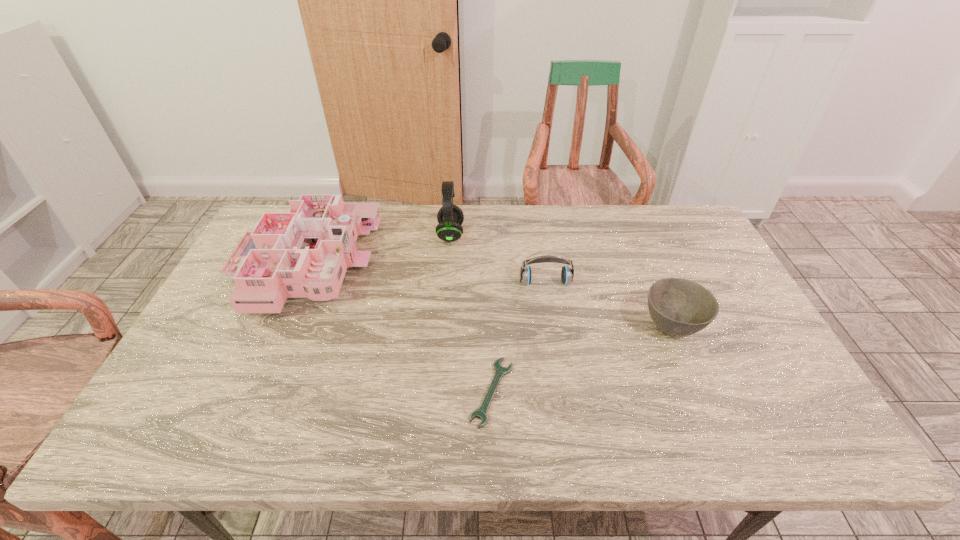
The image size is (960, 540). Find the location of `vacant space at the near edge of the desktop`. vacant space at the near edge of the desktop is located at coordinates (684, 423).

The height and width of the screenshot is (540, 960). In the image, there is a desktop. What are the coordinates of `free space at the left edge` in the screenshot? It's located at (217, 333).

In the image, there is a desktop. Where is `vacant space at the right edge`? The image size is (960, 540). vacant space at the right edge is located at coordinates [745, 321].

Find the location of a particular element. Image resolution: width=960 pixels, height=540 pixels. free space at the far right corner of the desktop is located at coordinates (674, 229).

Find the location of a particular element. The image size is (960, 540). free space between the leftmost object and the left headset is located at coordinates pos(377,249).

At what (x,y) coordinates should I click in order to perform the action: click on empty space between the dollhouse and the right headset. Please return your answer as a coordinate pair (x, y). Image resolution: width=960 pixels, height=540 pixels. Looking at the image, I should click on (425, 273).

I want to click on free spot between the taller headset and the second object from right to left, so click(498, 259).

You are a GUI agent. You are given a task and a screenshot of the screen. Output one action in this format:
    pyautogui.click(x=<x>, y=<y>)
    Task: Click on the empty space that is in between the fourth object from right to left and the right headset
    
    Given the screenshot: What is the action you would take?
    pyautogui.click(x=498, y=259)

Locate an element on the screen. The height and width of the screenshot is (540, 960). empty location between the shortest object and the rightmost object is located at coordinates (582, 359).

At what (x,y) coordinates should I click in order to perform the action: click on vacant point located between the nearest object and the leftmost object. Please return your answer as a coordinate pair (x, y). Looking at the image, I should click on point(398,328).